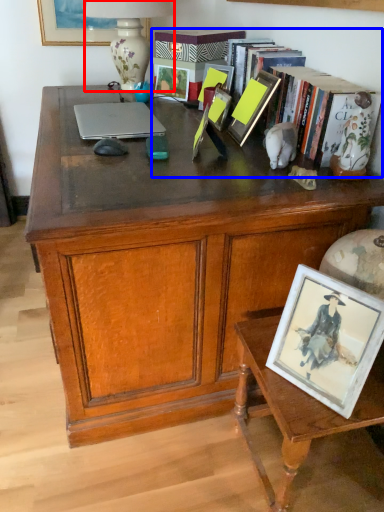
Question: Which object is closer to the camera taking this photo, lamp (highlighted by a red box) or book (highlighted by a blue box)?

Choices:
 (A) lamp
 (B) book

Answer: (B)